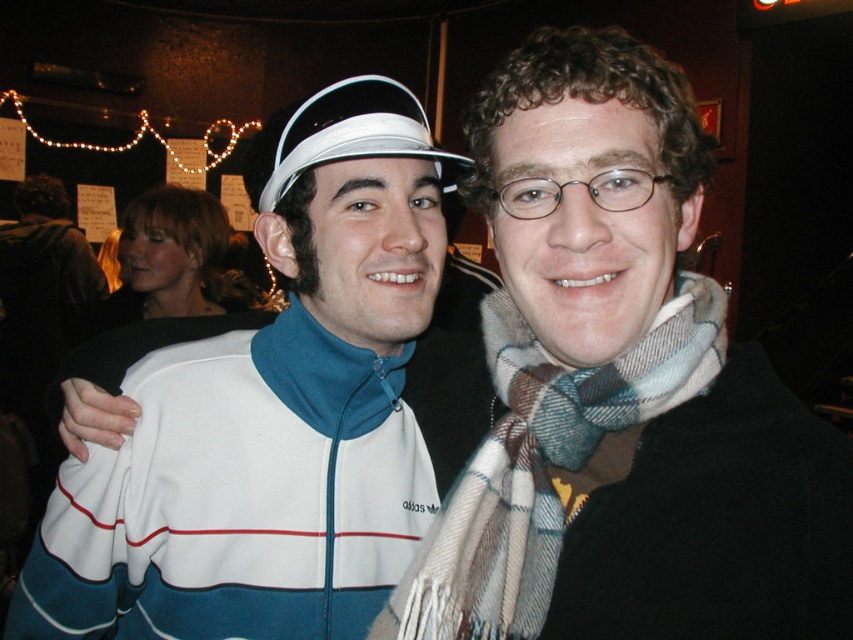
Question: Which point is farther from the camera taking this photo?

Choices:
 (A) (469, 552)
 (B) (292, 593)
 (C) (247, 182)

Answer: (C)

Question: Does white matte visor at upper center come in front of plaid wool scarf at right?

Choices:
 (A) yes
 (B) no

Answer: (B)

Question: Which of the following is the closest to the observer?

Choices:
 (A) (485, 461)
 (B) (398, 257)
 (C) (424, 116)

Answer: (A)

Question: Is plaid wool scarf at right above white fabric visor at upper center?

Choices:
 (A) no
 (B) yes

Answer: (A)

Question: Does white matte visor at upper center have a smaller size compared to plaid wool scarf at right?

Choices:
 (A) yes
 (B) no

Answer: (B)

Question: Among these points, which one is farthest from the camera?

Choices:
 (A) (86, 465)
 (B) (254, 196)
 (C) (605, 401)

Answer: (B)